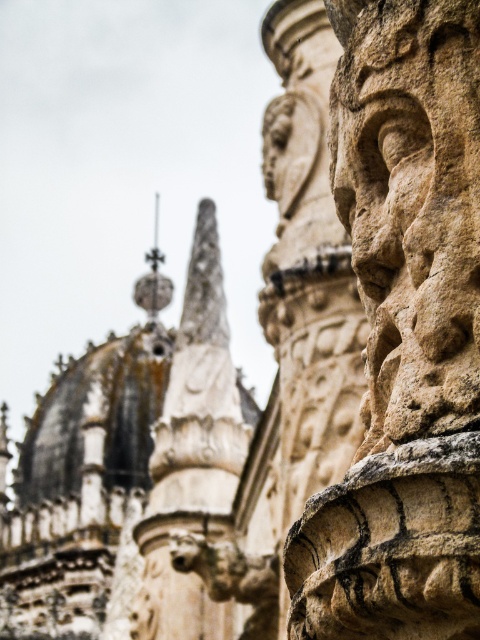
Based on the coordinates provided, where is the white stone spire at upper center located in the image?

The white stone spire at upper center is located at the coordinates point [192,456] in the image.

You are an architect examining the stone carvings and spires of a Gothic cathedral. You need to determine which spire is taller between the white stone spire at upper center and the polished silver spire at center. Based on the carvings and structure, which one is taller?

The white stone spire at upper center is much taller than the polished silver spire at center.

You are an architect analyzing the stone carvings in the image. The stone textured face at right is represented by point (x=410, y=205). Is the point located in the lower half of the image?

The point (x=410, y=205) is located in the upper half of the image since the y coordinate is 0.856, which is greater than 0.5.